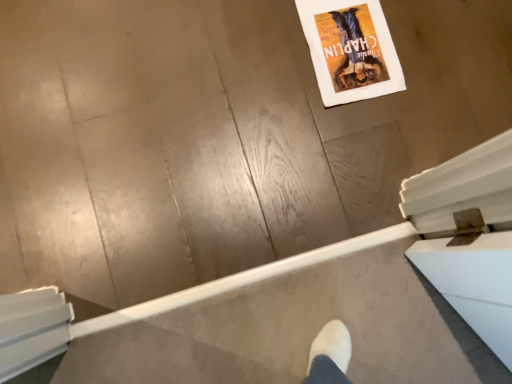
Where is `vacant space to the right of white paper towel at upper center`? The width and height of the screenshot is (512, 384). vacant space to the right of white paper towel at upper center is located at coordinates (432, 52).